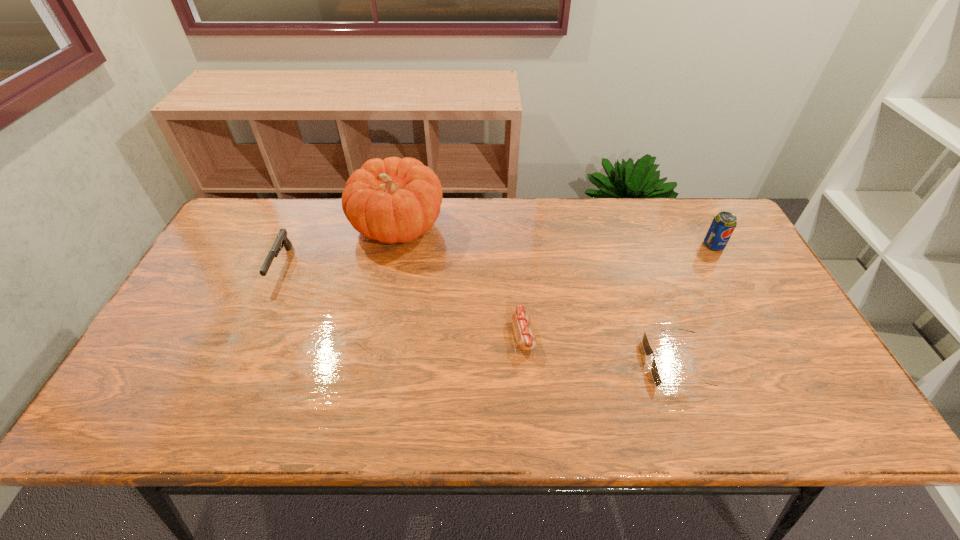
I want to click on vacant space that satisfies the following two spatial constraints: 1. at the muzzle end of the fourth tallest object; 2. on the right side of the gun, so click(250, 335).

Identify the location of free spot that satisfies the following two spatial constraints: 1. on the front side of the soda; 2. on the front-facing side of the second object from right to left. The height and width of the screenshot is (540, 960). (779, 364).